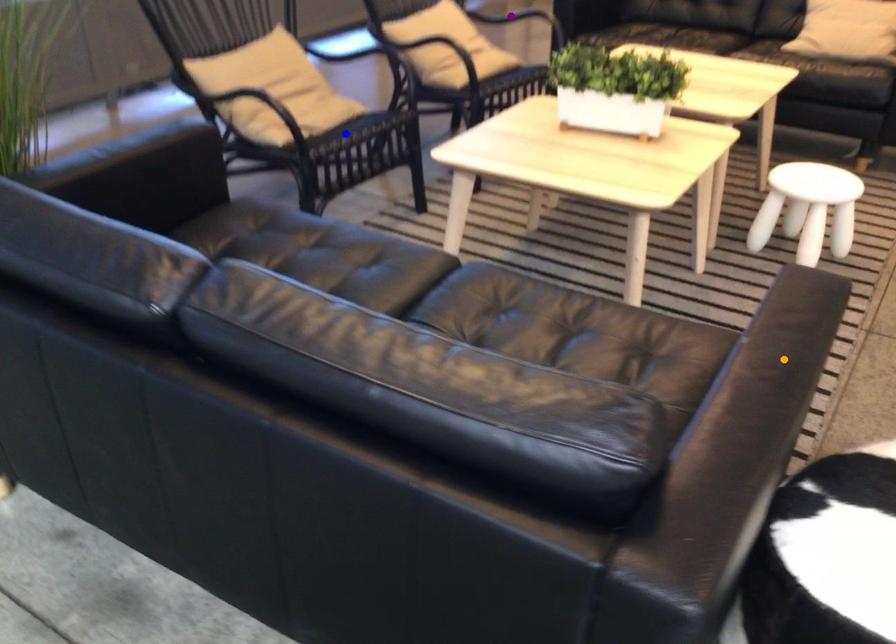
Order these from farthest to nearest:
blue point
purple point
orange point

purple point → blue point → orange point